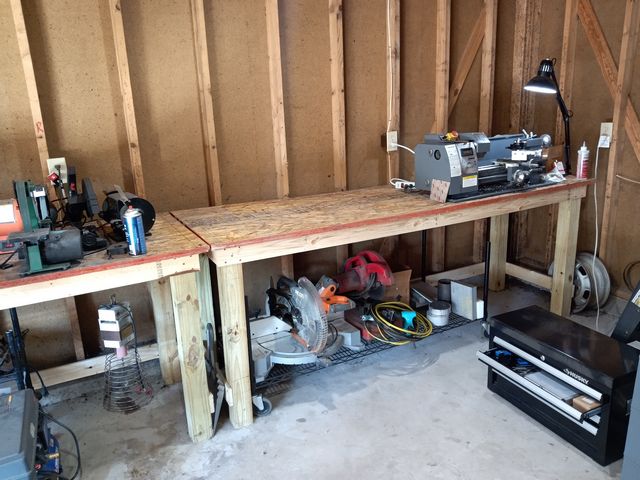
Identify the location of wires. The height and width of the screenshot is (480, 640). (404, 329), (401, 339).